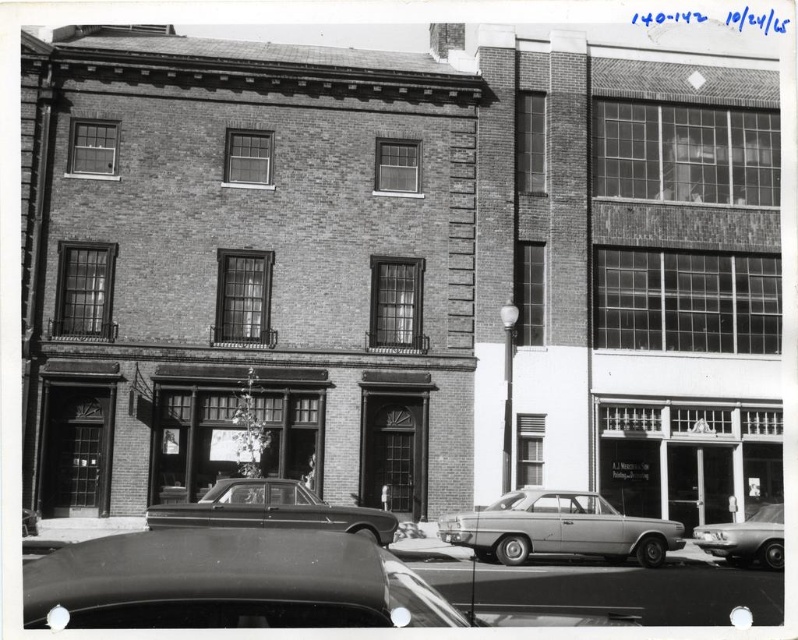
Between shiny black car at lower center and shiny metallic sedan at center, which one appears on the right side from the viewer's perspective?

shiny black car at lower center is more to the right.

Between point (87, 596) and point (149, 513), which one is positioned in front?

Point (87, 596) is more forward.

This screenshot has height=640, width=798. I want to click on shiny black car at lower center, so click(230, 582).

You are a GUI agent. You are given a task and a screenshot of the screen. Output one action in this format:
    pyautogui.click(x=<x>, y=<y>)
    Task: Click on the shiny black car at lower center
    The image size is (798, 640).
    Given the screenshot: What is the action you would take?
    pyautogui.click(x=230, y=582)

Can you confirm if smooth glass storefront at center is taller than silver metallic sedan at center?

Correct, smooth glass storefront at center is much taller as silver metallic sedan at center.

Is point (727, 474) closer to camera compared to point (635, 529)?

That is False.

Locate an element on the screen. The height and width of the screenshot is (640, 798). smooth glass storefront at center is located at coordinates (686, 460).

Who is higher up, smooth glass storefront at center or shiny silver sedan at lower right?

smooth glass storefront at center

You are a GUI agent. You are given a task and a screenshot of the screen. Output one action in this format:
    pyautogui.click(x=<x>, y=<y>)
    Task: Click on the smooth glass storefront at center
    The image size is (798, 640).
    Given the screenshot: What is the action you would take?
    pyautogui.click(x=686, y=460)

Find the location of a particular element. The width and height of the screenshot is (798, 640). smooth glass storefront at center is located at coordinates (686, 460).